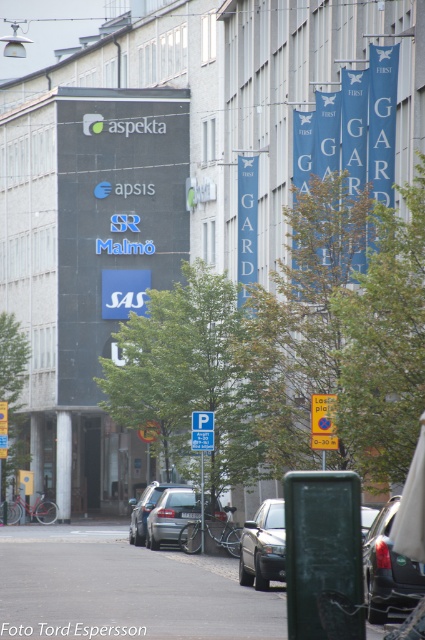
Who is more forward, (152, 524) or (210, 444)?

Positioned in front is point (210, 444).

Looking at this image, does silver metallic sedan at center have a larger size compared to white plastic parking sign at center?

Correct, silver metallic sedan at center is larger in size than white plastic parking sign at center.

Does point (164, 536) come in front of point (197, 448)?

No, it is not.

The image size is (425, 640). I want to click on silver metallic sedan at center, so click(x=170, y=515).

Is point (170, 177) closer to viewer compared to point (260, 522)?

No.

Find the location of a particular element. The image size is (425, 640). matte black signboard at center is located at coordinates (115, 218).

Can you confirm if matte black signboard at center is taller than silver metallic sedan at center?

Yes.

Is matte black signboard at center further to the viewer compared to silver metallic sedan at center?

Yes.

Between point (68, 106) and point (184, 520), which one is positioned in front?

Point (184, 520) is more forward.

Locate an element on the screen. The image size is (425, 640). matte black signboard at center is located at coordinates (115, 218).